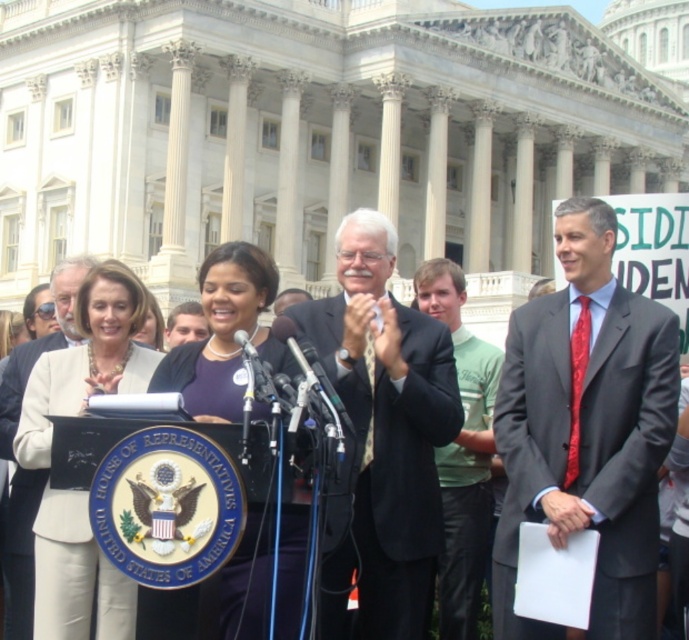
Question: Which point is farther from the camera taking this photo?

Choices:
 (A) (48, 356)
 (B) (668, 394)

Answer: (A)

Question: Is white fabric jacket at center thinner than matte purple dress at center?

Choices:
 (A) yes
 (B) no

Answer: (A)

Question: Can you confirm if dark suit at center is thinner than white fabric jacket at center?

Choices:
 (A) yes
 (B) no

Answer: (B)

Question: Does green cotton shirt at center have a smaller size compared to light brown hair at center?

Choices:
 (A) no
 (B) yes

Answer: (A)

Question: Among these objects, which one is farthest from the camera?

Choices:
 (A) light brown hair at center
 (B) matte purple dress at center

Answer: (A)

Question: Among these objects, which one is farthest from the camera?

Choices:
 (A) dark gray suit at center
 (B) white fabric jacket at center
 (C) dark suit at center
 (D) light brown hair at center

Answer: (D)